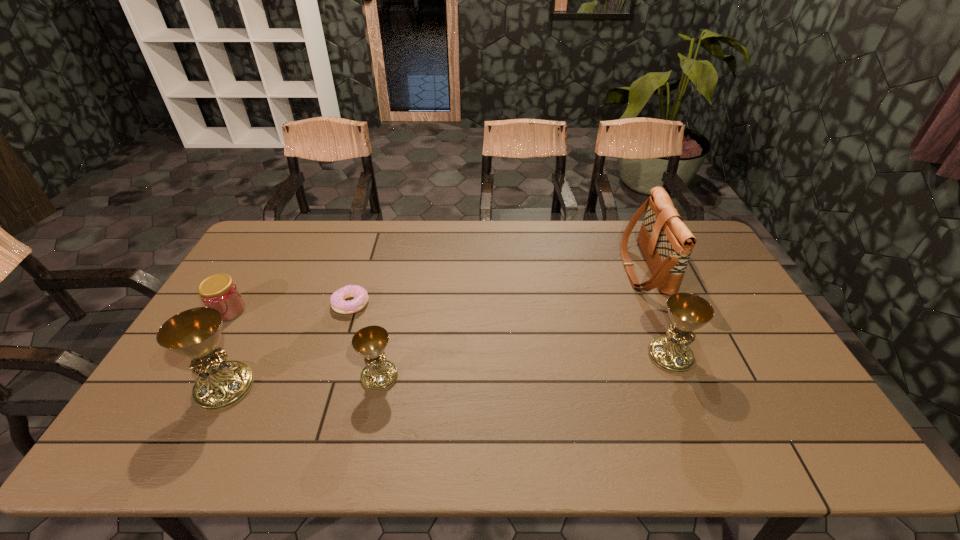
You are a GUI agent. You are given a task and a screenshot of the screen. Output one action in this format:
    pyautogui.click(x=<x>, y=<y>)
    Task: Click on the object at the near left corner
    
    Given the screenshot: What is the action you would take?
    pyautogui.click(x=195, y=333)

Where is `vacant space at the far edge`? vacant space at the far edge is located at coordinates pos(326,221).

This screenshot has width=960, height=540. In the image, there is a desktop. What are the coordinates of `vacant region at the left edge` in the screenshot? It's located at (260, 317).

Where is `free space at the right edge`? This screenshot has width=960, height=540. free space at the right edge is located at coordinates (748, 363).

Identify the location of free space at the far left corner of the desktop. Image resolution: width=960 pixels, height=540 pixels. (295, 248).

Where is `free space at the far right corner`? Image resolution: width=960 pixels, height=540 pixels. free space at the far right corner is located at coordinates (696, 244).

Identify the location of empty location between the jam and the fourth shortest object. The width and height of the screenshot is (960, 540). (449, 333).

Identify the location of empty space between the tallest chalice and the fourth shortest object. The height and width of the screenshot is (540, 960). (447, 372).

At what (x,y) coordinates should I click in order to perform the action: click on unoccupied area between the shortest object and the second shortest object. Please return your answer as a coordinate pair (x, y). Image resolution: width=960 pixels, height=540 pixels. Looking at the image, I should click on (289, 307).

What are the coordinates of `free space that is in between the second shortest object and the shoulder bag` in the screenshot? It's located at click(x=436, y=289).